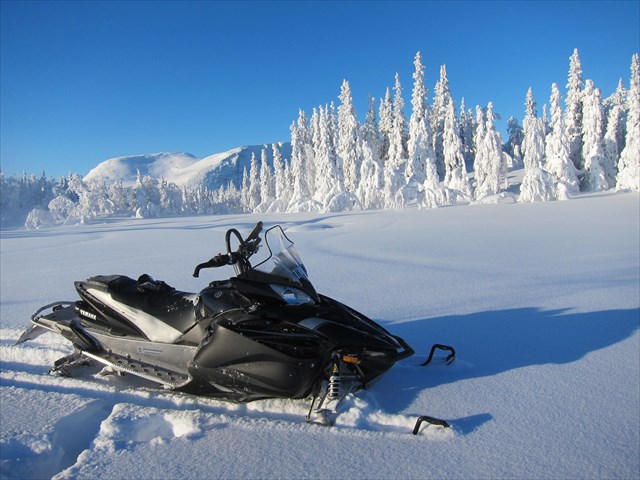
Locate an element on the screen. This screenshot has height=480, width=640. hooks on front is located at coordinates (449, 346), (427, 418).